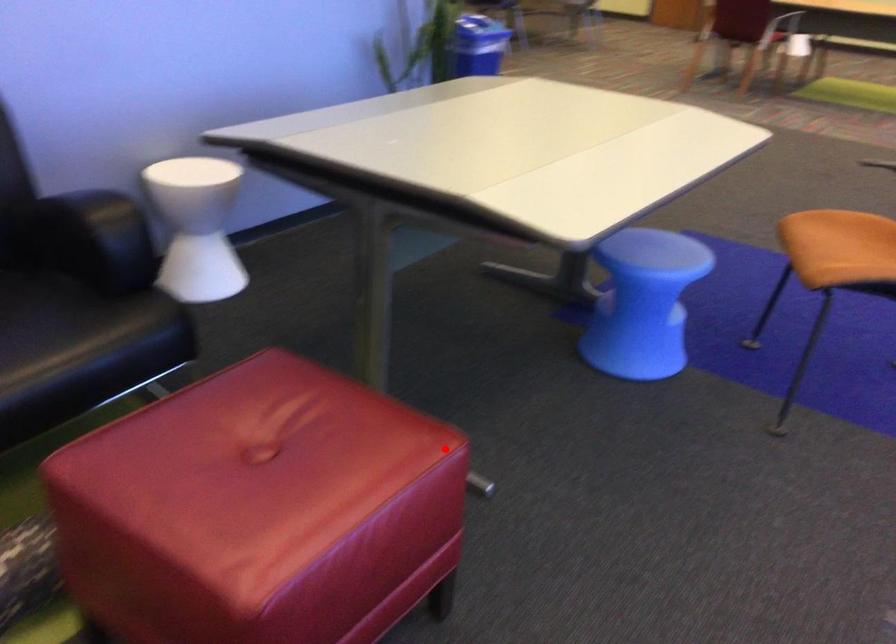
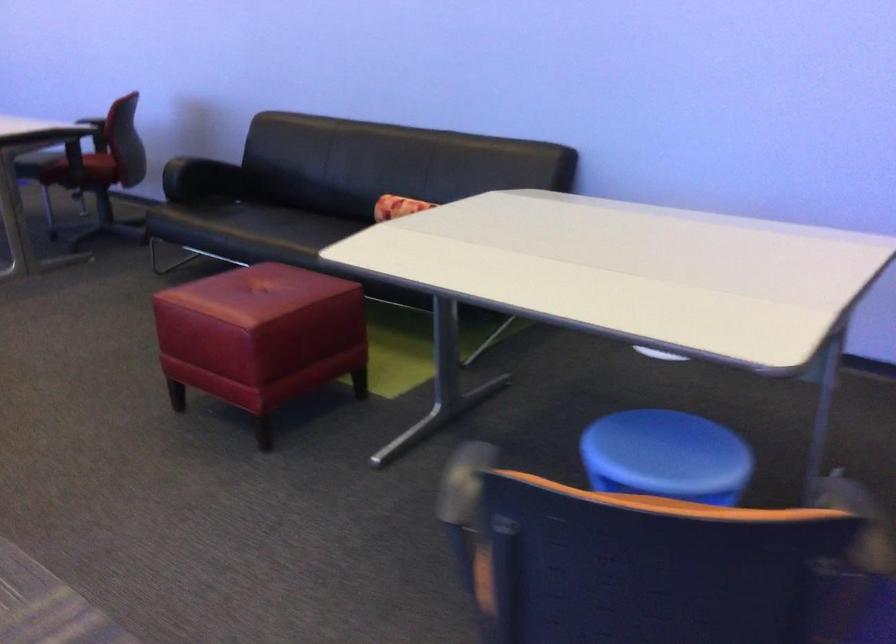
Find the pixel in the second image that matches the highlighted location in the first image.

(261, 337)